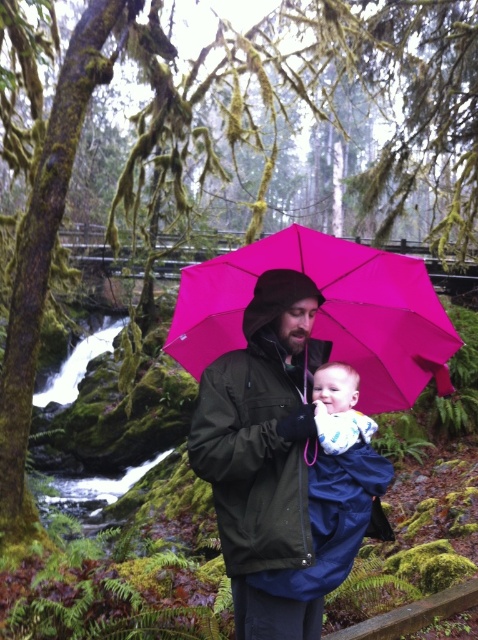
Can you confirm if pink matte umbrella at center is thinner than blue cotton onesie at center?

No.

Is point (341, 349) farther from viewer compared to point (335, 449)?

Yes.

Is point (319, 257) closer to viewer compared to point (321, 424)?

No, it is behind (321, 424).

In order to click on pink matte umbrella at center in this screenshot , I will do `click(325, 310)`.

Is matte black jacket at center to the left of blue cotton onesie at center from the viewer's perspective?

Correct, you'll find matte black jacket at center to the left of blue cotton onesie at center.

Does point (271, 404) lie behind point (338, 420)?

Yes, point (271, 404) is farther from viewer.

Where is `matte black jacket at center`? matte black jacket at center is located at coordinates (285, 464).

Locate an element on the screen. The image size is (478, 640). matte black jacket at center is located at coordinates (285, 464).

From the picture: How distant is matte black jacket at center from blue fabric baby at center?

The distance of matte black jacket at center from blue fabric baby at center is 7.71 inches.

This screenshot has width=478, height=640. In order to click on matte black jacket at center in this screenshot , I will do (285, 464).